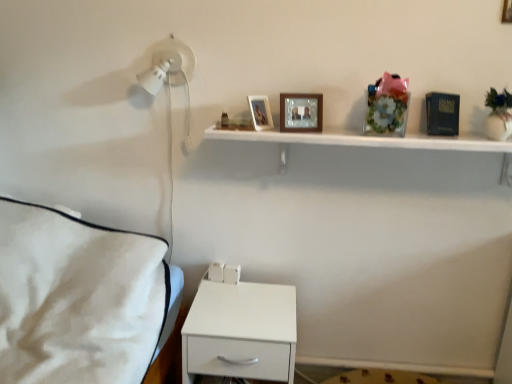
Question: Which direction should I rotate to look at wooden picture frame at upper center, the third picture frame positioned from the top?

Choices:
 (A) left
 (B) right

Answer: (B)

Question: Is wooden picture frame at upper center, positioned as the third picture frame in left-to-right order, to the left of white glossy shelf at upper center from the viewer's perspective?

Choices:
 (A) no
 (B) yes

Answer: (A)

Question: Considering the relative sizes of wooden picture frame at upper center, which is the first picture frame from top to bottom, and white glossy shelf at upper center in the image provided, is wooden picture frame at upper center, which is the first picture frame from top to bottom, taller than white glossy shelf at upper center?

Choices:
 (A) no
 (B) yes

Answer: (B)

Question: Is wooden picture frame at upper center, acting as the third picture frame starting from the bottom, next to white glossy shelf at upper center and touching it?

Choices:
 (A) no
 (B) yes

Answer: (A)

Question: Is wooden picture frame at upper center, which is the first picture frame from top to bottom, far from white glossy shelf at upper center?

Choices:
 (A) yes
 (B) no

Answer: (B)

Question: Does wooden picture frame at upper center, acting as the third picture frame starting from the bottom, have a lesser height compared to white glossy shelf at upper center?

Choices:
 (A) yes
 (B) no

Answer: (B)

Question: From the image's perspective, is wooden picture frame at upper center, which is the first picture frame from top to bottom, beneath white glossy shelf at upper center?

Choices:
 (A) no
 (B) yes

Answer: (A)

Question: From the image's perspective, is wooden picture frame at upper center, acting as the third picture frame starting from the bottom, located above wooden picture frame at upper center, the third picture frame positioned from the top?

Choices:
 (A) no
 (B) yes

Answer: (B)

Question: Can you confirm if wooden picture frame at upper center, which is the first picture frame from right to left, is smaller than wooden picture frame at upper center, the 2th picture frame positioned from the left?

Choices:
 (A) no
 (B) yes

Answer: (B)

Question: From the image's perspective, would you say wooden picture frame at upper center, which is the first picture frame from top to bottom, is shown under wooden picture frame at upper center, the 2th picture frame positioned from the left?

Choices:
 (A) no
 (B) yes

Answer: (A)

Question: Is wooden picture frame at upper center, arranged as the 2th picture frame when viewed from the right, surrounded by wooden picture frame at upper center, which is the first picture frame from top to bottom?

Choices:
 (A) no
 (B) yes

Answer: (A)

Question: Is wooden picture frame at upper center, acting as the third picture frame starting from the bottom, thinner than wooden picture frame at upper center, which ranks as the first picture frame in bottom-to-top order?

Choices:
 (A) yes
 (B) no

Answer: (A)

Question: Can you see wooden picture frame at upper center, which is the first picture frame from top to bottom, touching wooden picture frame at upper center, which ranks as the first picture frame in bottom-to-top order?

Choices:
 (A) no
 (B) yes

Answer: (A)

Question: Could white glossy shelf at upper center be considered to be inside white matte nightstand at lower center?

Choices:
 (A) yes
 (B) no

Answer: (B)